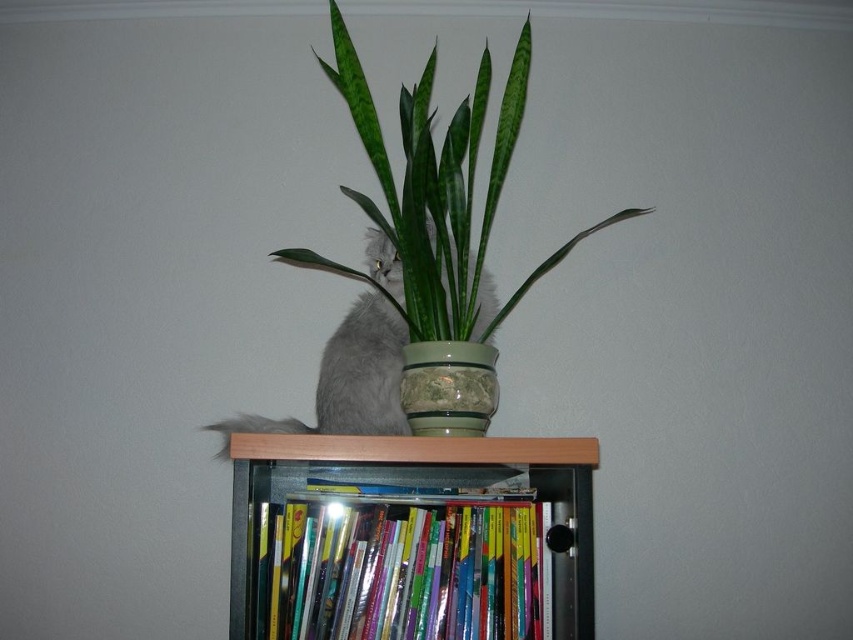
Question: Which point is farther to the camera?

Choices:
 (A) green glossy pot at upper center
 (B) fluffy gray cat at center
 (C) translucent plastic bookcase at center

Answer: (A)

Question: Is green glossy pot at upper center to the left of translucent plastic bookcase at center from the viewer's perspective?

Choices:
 (A) no
 (B) yes

Answer: (A)

Question: Estimate the real-world distances between objects in this image. Which object is farther from the translucent plastic bookcase at center?

Choices:
 (A) fluffy gray cat at center
 (B) green glossy pot at upper center

Answer: (B)

Question: Can you confirm if green glossy pot at upper center is positioned above fluffy gray cat at center?

Choices:
 (A) yes
 (B) no

Answer: (A)

Question: Based on their relative distances, which object is nearer to the translucent plastic bookcase at center?

Choices:
 (A) green glossy pot at upper center
 (B) fluffy gray cat at center

Answer: (B)

Question: Is translucent plastic bookcase at center positioned behind fluffy gray cat at center?

Choices:
 (A) no
 (B) yes

Answer: (A)